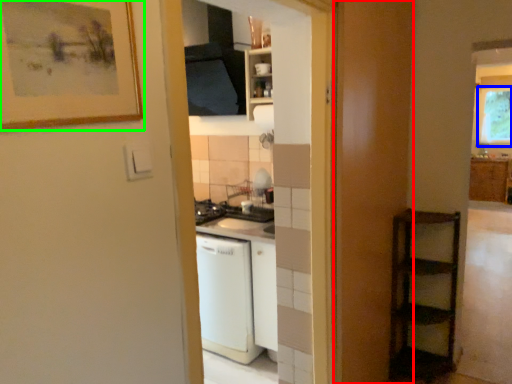
Question: Based on their relative distances, which object is farther from screen door (highlighted by a red box)? Choose from window (highlighted by a blue box) and picture frame (highlighted by a green box).

Choices:
 (A) window
 (B) picture frame

Answer: (A)